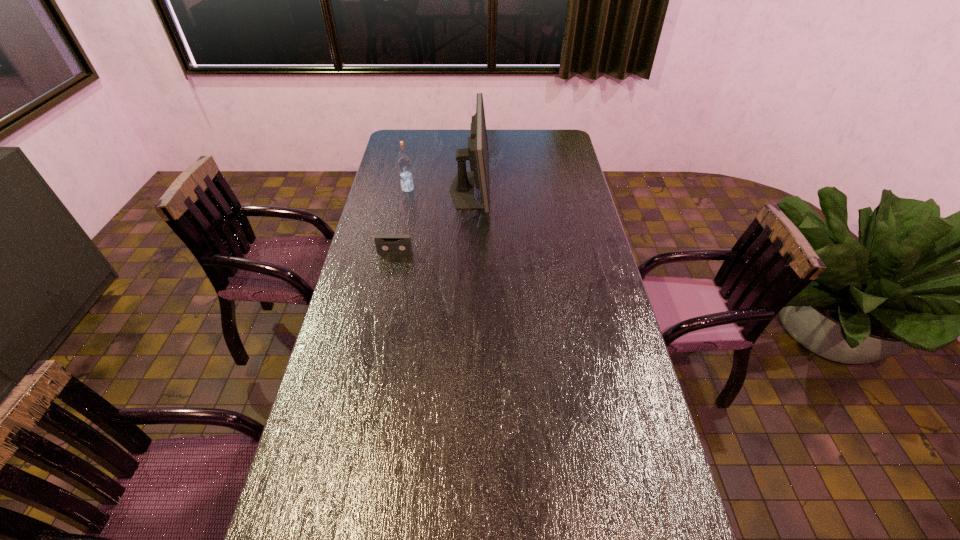
The width and height of the screenshot is (960, 540). What are the coordinates of `vacant space at the far edge of the desktop` in the screenshot? It's located at (468, 131).

Locate an element on the screen. free region at the left edge of the desktop is located at coordinates (351, 416).

Image resolution: width=960 pixels, height=540 pixels. What are the coordinates of `free region at the right edge` in the screenshot? It's located at (597, 349).

Locate an element on the screen. free region at the far right corner of the desktop is located at coordinates (546, 142).

You are a GUI agent. You are given a task and a screenshot of the screen. Output one action in this format:
    pyautogui.click(x=<x>, y=<y>)
    Task: Click on the free space between the videotape and the second shortest object
    The width and height of the screenshot is (960, 540).
    Given the screenshot: What is the action you would take?
    pyautogui.click(x=401, y=221)

Locate an element on the screen. The width and height of the screenshot is (960, 540). vacant point located between the vodka and the tallest object is located at coordinates (439, 190).

Identify the location of free space between the second tallest object and the nearest object. This screenshot has height=540, width=960. (401, 221).

You are a GUI agent. You are given a task and a screenshot of the screen. Output one action in this format:
    pyautogui.click(x=<x>, y=<y>)
    Task: Click on the free space between the nearest object and the tallest object
    The image size is (960, 540).
    Given the screenshot: What is the action you would take?
    pyautogui.click(x=432, y=221)

The width and height of the screenshot is (960, 540). I want to click on vacant region between the shortest object and the computer monitor, so click(432, 221).

Find the location of a particular element. Image resolution: width=960 pixels, height=540 pixels. object that is the second closest to the rightmost object is located at coordinates (385, 243).